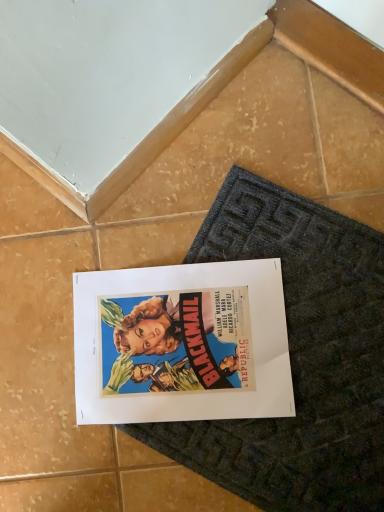
The image size is (384, 512). In order to click on free space above matte paper poster at center (from a real-world perspective) in this screenshot , I will do `click(186, 334)`.